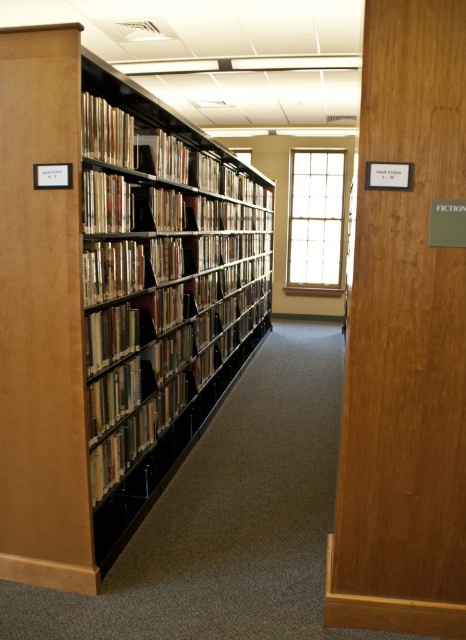
Question: Which point appears farthest from the camera in this image?

Choices:
 (A) (192, 225)
 (B) (122, 342)

Answer: (A)

Question: Is black metal bookshelf at left thinner than hardcover book at center?

Choices:
 (A) no
 (B) yes

Answer: (A)

Question: Which point is farther to the camera?

Choices:
 (A) (137, 326)
 (B) (128, 374)

Answer: (A)

Question: Is black metal bookshelf at left wider than hardcover book at center?

Choices:
 (A) yes
 (B) no

Answer: (A)

Question: Is black metal bookshelf at left thinner than hardcover book at center?

Choices:
 (A) yes
 (B) no

Answer: (B)